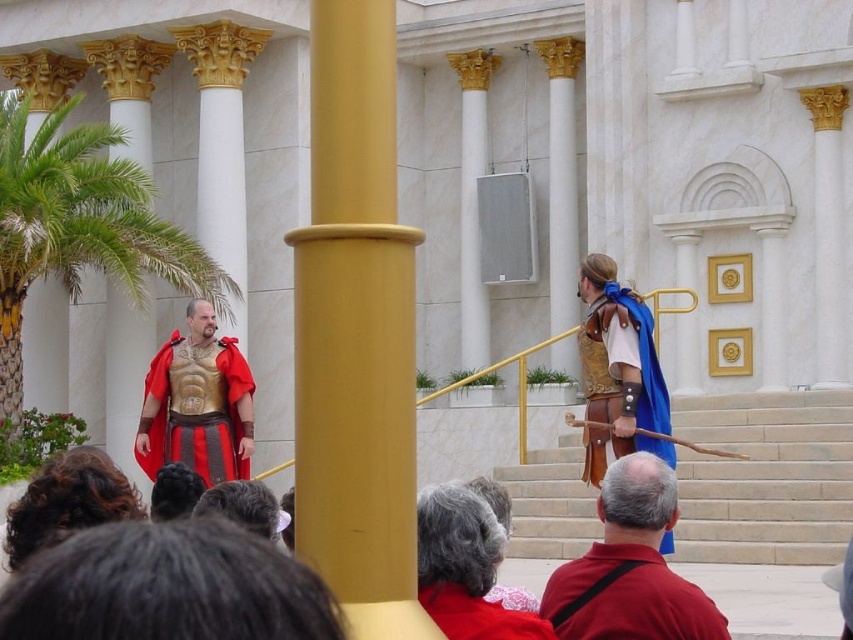
Question: Considering the real-world distances, which object is farthest from the velvet red cape at center?

Choices:
 (A) yellow matte pole at center
 (B) blue leather armor at right
 (C) red leather belt at center
 (D) green leafy palm tree at left

Answer: (D)

Question: Among these objects, which one is farthest from the camera?

Choices:
 (A) yellow matte pole at center
 (B) velvet red cape at center
 (C) gold metallic armor at center
 (D) blue leather armor at right

Answer: (C)

Question: Observing the image, what is the correct spatial positioning of gold metallic armor at center in reference to velvet red cape at center?

Choices:
 (A) right
 (B) left

Answer: (B)

Question: Considering the real-world distances, which object is closest to the yellow matte pole at center?

Choices:
 (A) blue leather armor at right
 (B) green leafy palm tree at left
 (C) velvet red cape at center
 (D) gold metallic armor at center

Answer: (C)

Question: Can you confirm if yellow matte pole at center is positioned below red leather belt at center?

Choices:
 (A) yes
 (B) no

Answer: (B)

Question: Can you confirm if gold metallic armor at center is positioned to the left of velvet red cape at center?

Choices:
 (A) yes
 (B) no

Answer: (A)